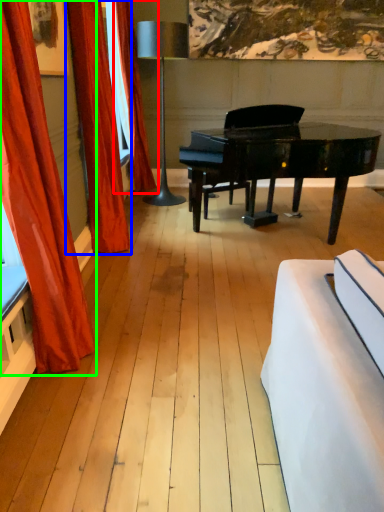
Question: Based on their relative distances, which object is farther from curtain (highlighted by a red box)? Choose from curtain (highlighted by a blue box) and curtain (highlighted by a green box).

Choices:
 (A) curtain
 (B) curtain

Answer: (B)